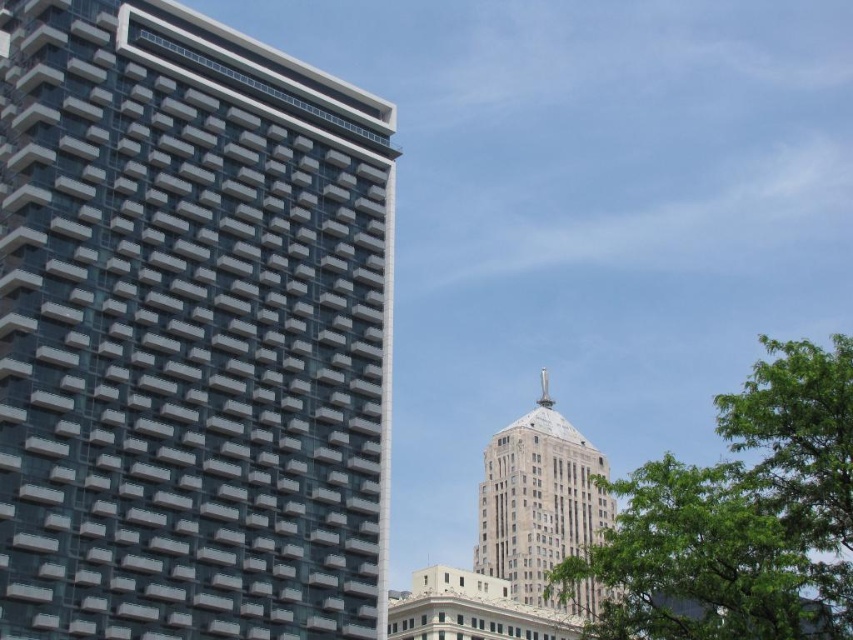
You are standing at the point marked as point (686,577) and want to walk to the modern highrise building on the left. The path is straight. If you walk at a speed of 1.5 meters per second, how long will it take you to reach the modern highrise building on the left?

The distance between you and the modern highrise building on the left is 21.54 meters. At a speed of 1.5 meters per second, it will take approximately 14.36 seconds to reach the building.

You are an urban planner assessing the city layout. You need to determine if the green leafy tree at center right can provide shade to the gray stone tower at center during the afternoon. Based on their positions, can the tree cast shade on the tower?

The green leafy tree at center right is located above the gray stone tower at center, so it cannot cast shade on the tower as it is positioned higher up and would not block sunlight from reaching the tower below.

You are standing in the middle of the city square and want to take a photo of both the glassy reflective building at left and the gray stone tower at center. Based on their positions, which building should you position to your left side to include both in the frame?

You should position the glassy reflective building at left to your left side since it is already to the left of the gray stone tower at center, allowing both to be captured in the photo.